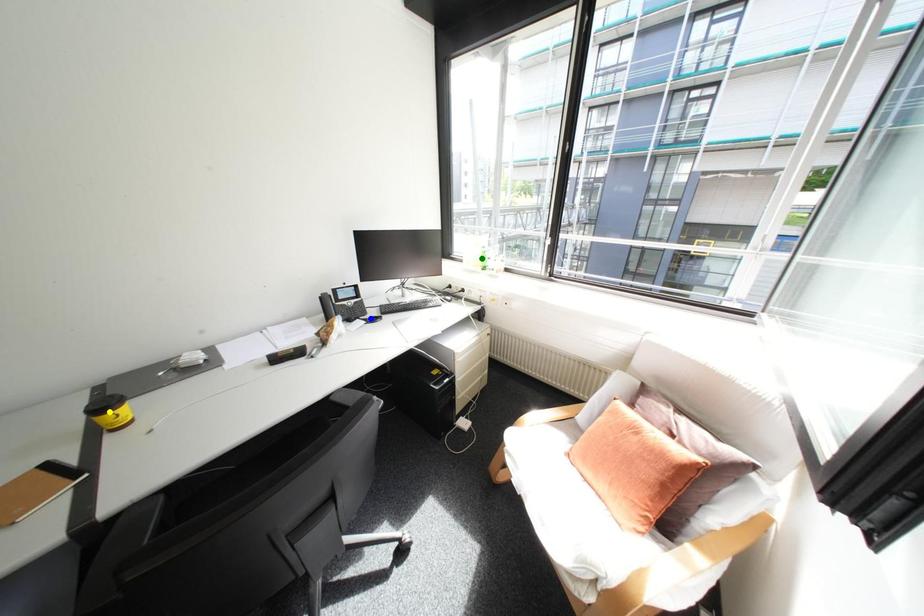
Order these from farthest to nearest:
- green point
- yellow point
- blue point

1. green point
2. blue point
3. yellow point